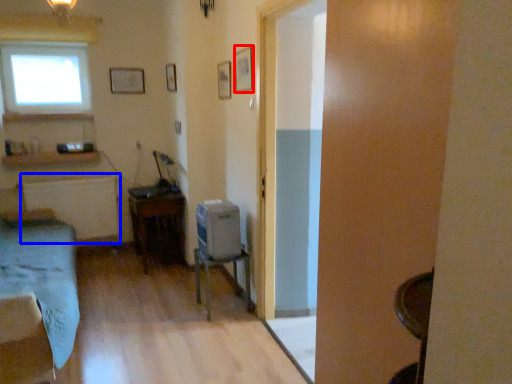
Question: Which of the following is the farthest to the observer, picture frame (highlighted by a red box) or radiator (highlighted by a blue box)?

Choices:
 (A) picture frame
 (B) radiator

Answer: (B)